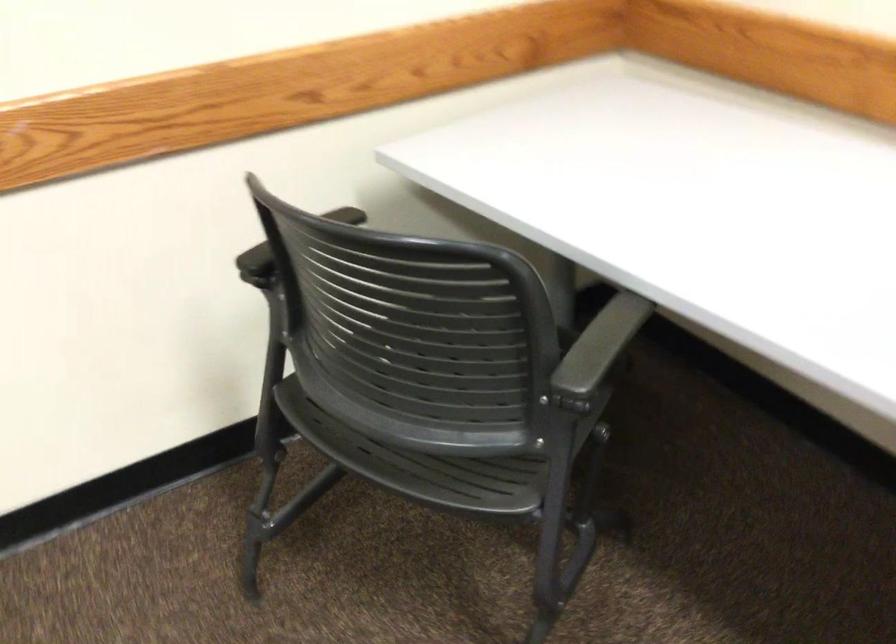
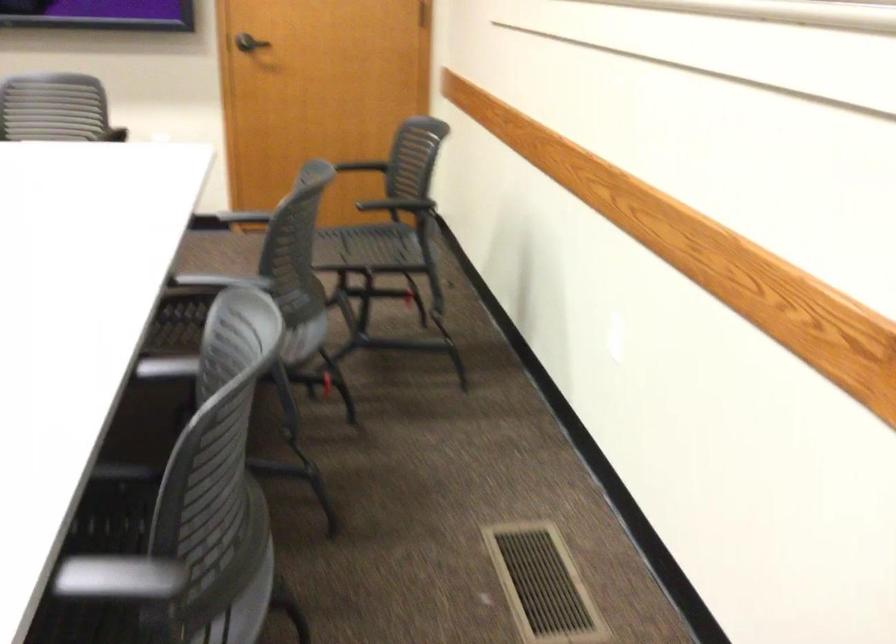
Based on the continuous images, in which direction is the camera rotating?

The camera's rotation is toward left-down.